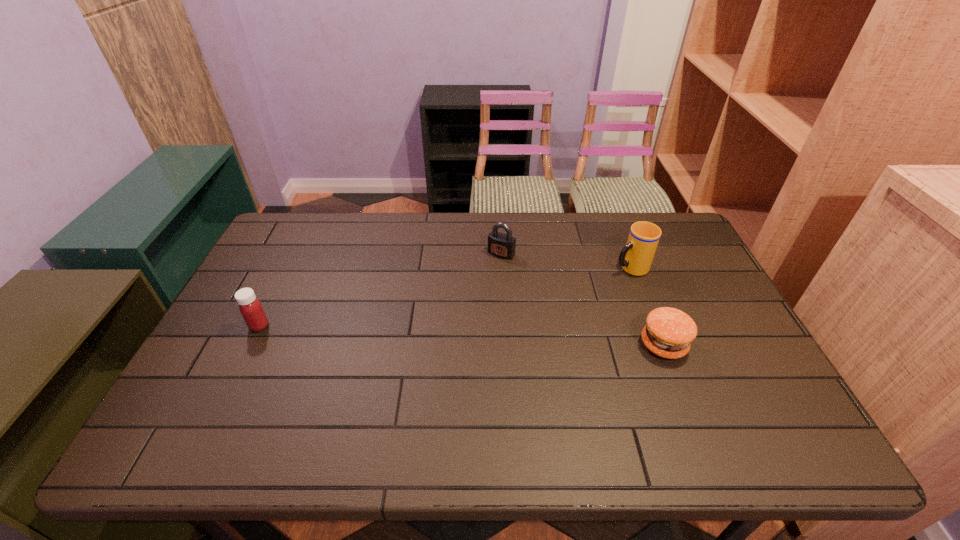
Identify the location of vacant space on the desktop that is between the medicine and the patty and is positioned on the front of the padlock near the keyhole. This screenshot has height=540, width=960. (440, 334).

Identify the location of free spot on the desktop that is between the medicine and the shortest object and is positioned on the side of the tallest object with the handle. This screenshot has height=540, width=960. 457,335.